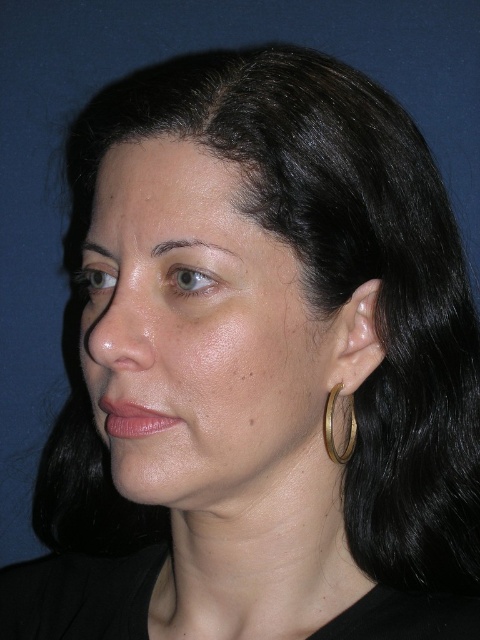
Who is more distant from viewer, (x=122, y=326) or (x=351, y=428)?

The point (x=351, y=428) is more distant.

Identify the location of smooth skin face at center. The image size is (480, 640). coord(201,340).